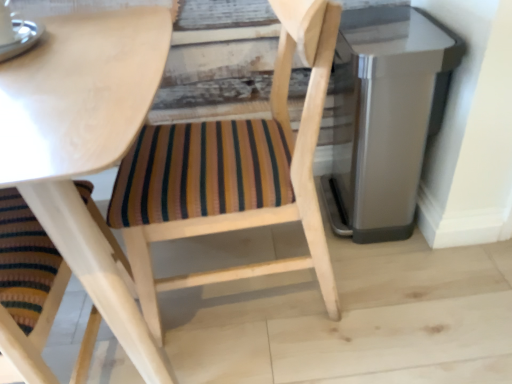
Question: Considering the positions of satin silver trash can at right and wooden chair with striped cushion at center in the image, is satin silver trash can at right bigger or smaller than wooden chair with striped cushion at center?

Choices:
 (A) big
 (B) small

Answer: (B)

Question: In terms of width, does satin silver trash can at right look wider or thinner when compared to wooden chair with striped cushion at center?

Choices:
 (A) wide
 (B) thin

Answer: (B)

Question: From the image's perspective, relative to wooden chair with striped cushion at center, is satin silver trash can at right above or below?

Choices:
 (A) above
 (B) below

Answer: (A)

Question: Based on their positions, is wooden chair with striped cushion at center located to the left or right of satin silver trash can at right?

Choices:
 (A) right
 (B) left

Answer: (B)

Question: Do you think wooden chair with striped cushion at center is within satin silver trash can at right, or outside of it?

Choices:
 (A) outside
 (B) inside

Answer: (A)

Question: Based on their sizes in the image, would you say wooden chair with striped cushion at center is bigger or smaller than satin silver trash can at right?

Choices:
 (A) small
 (B) big

Answer: (B)

Question: Considering their positions, is wooden chair with striped cushion at center located in front of or behind satin silver trash can at right?

Choices:
 (A) behind
 (B) front

Answer: (B)